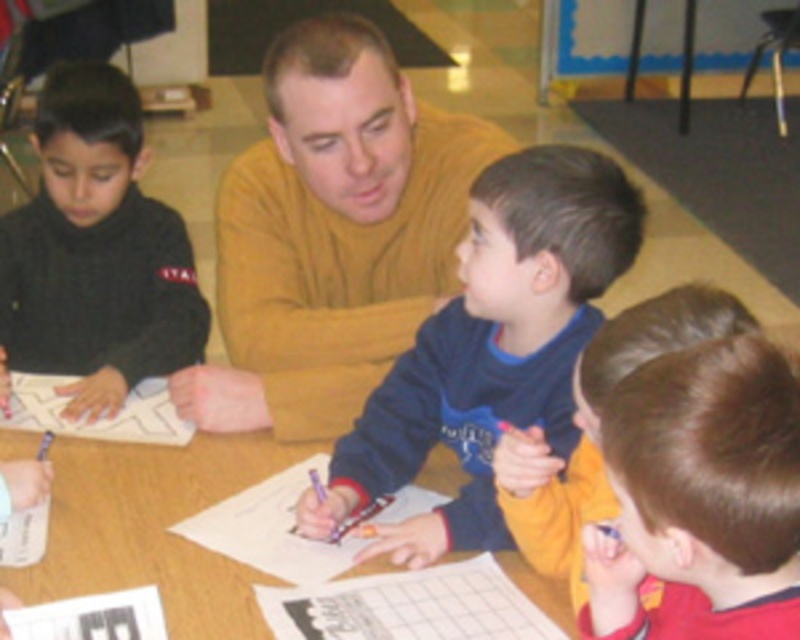
Is brown hair at lower right to the right of white paper at left from the viewer's perspective?

Yes, brown hair at lower right is to the right of white paper at left.

Is point (713, 596) more distant than point (58, 406)?

No, (713, 596) is closer to viewer.

Does point (604, 570) lie behind point (134, 396)?

No.

Identify the location of brown hair at lower right. (701, 497).

Is point (468, 228) closer to viewer compared to point (162, 403)?

That is True.

Identify the location of blue fleece sweater at center. (490, 348).

Does point (466, 365) come in front of point (198, 477)?

That is True.

Is point (520, 291) farther from viewer compared to point (62, 577)?

No.

Find the location of a particular element. This screenshot has height=640, width=800. blue fleece sweater at center is located at coordinates (490, 348).